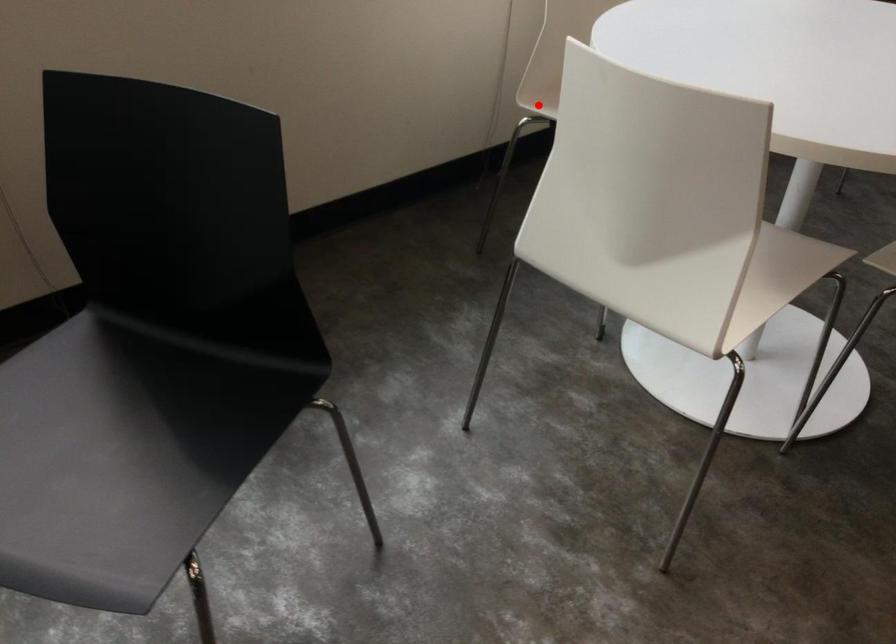
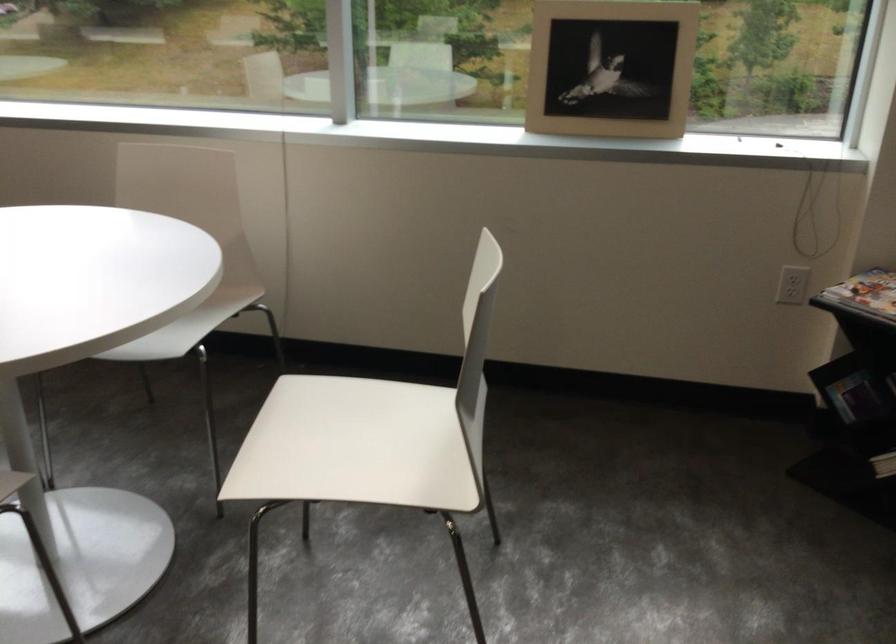
Question: I am providing you with two images of the same scene from different viewpoints. A red point is marked on the first image. Can you still see the location of the red point in image 2?

Choices:
 (A) Yes
 (B) No

Answer: (B)